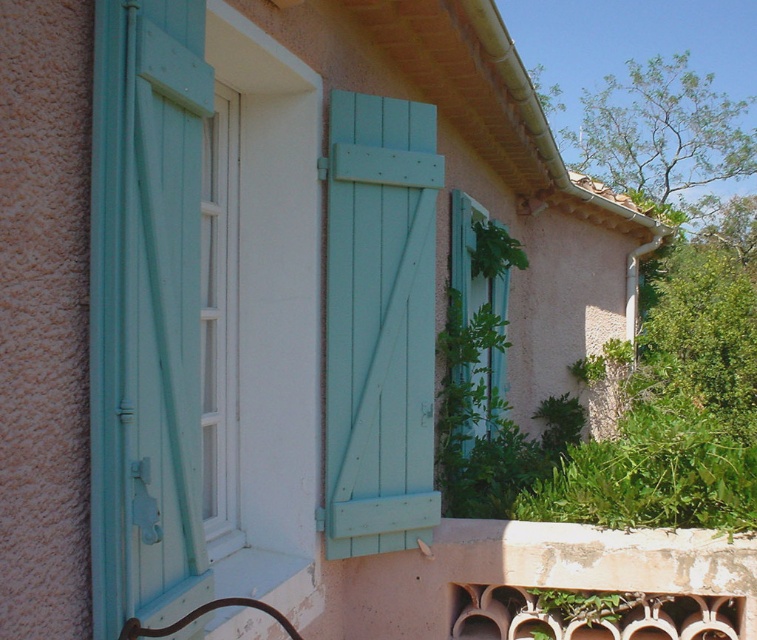
You are an architect designing a garden layout. You need to place a new teal wood shutter at left and a green leafy plant at lower right. Given their sizes, which object should be placed closer to the building wall to ensure proper spacing?

The teal wood shutter at left is smaller than the green leafy plant at lower right, so the teal wood shutter at left should be placed closer to the building wall to accommodate the larger plant.

You are a window installer assessing the building exterior. You need to replace the teal wood shutter at left and the green leafy plant at lower right. Which object is located above the other?

The teal wood shutter at left is positioned over the green leafy plant at lower right.